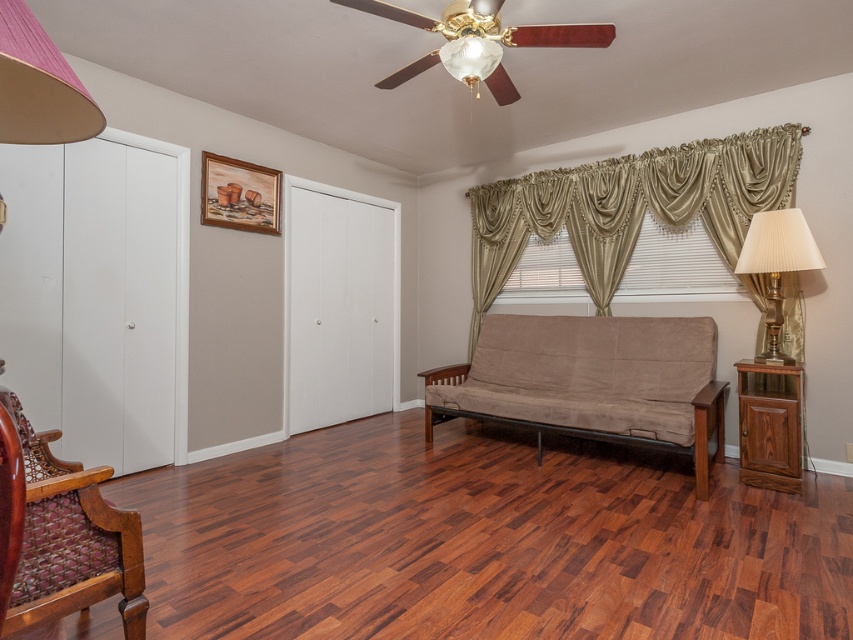
Is suede-like brown futon at center taller than wooden woven armchair at lower left?

Indeed, suede-like brown futon at center has a greater height compared to wooden woven armchair at lower left.

Which of these two, suede-like brown futon at center or wooden woven armchair at lower left, stands taller?

suede-like brown futon at center

Measure the distance between suede-like brown futon at center and camera.

They are 2.97 meters apart.

You are a GUI agent. You are given a task and a screenshot of the screen. Output one action in this format:
    pyautogui.click(x=<x>, y=<y>)
    Task: Click on the suede-like brown futon at center
    Image resolution: width=853 pixels, height=640 pixels.
    Given the screenshot: What is the action you would take?
    pyautogui.click(x=590, y=381)

Does point (772, 186) lie in front of point (770, 257)?

No, (772, 186) is further to viewer.

You are a GUI agent. You are given a task and a screenshot of the screen. Output one action in this format:
    pyautogui.click(x=<x>, y=<y>)
    Task: Click on the satin/golden drapes at upper right
    This screenshot has width=853, height=640.
    Given the screenshot: What is the action you would take?
    pyautogui.click(x=630, y=205)

Who is more distant from viewer, (x=595, y=189) or (x=792, y=241)?

The point (x=595, y=189) is behind.

Locate an element on the screen. The width and height of the screenshot is (853, 640). satin/golden drapes at upper right is located at coordinates (630, 205).

Does satin/golden drapes at upper right appear on the left side of walnut wood cabinet at right?

Indeed, satin/golden drapes at upper right is positioned on the left side of walnut wood cabinet at right.

Does point (705, 147) come behind point (793, 371)?

That is True.

Does point (729, 164) come behind point (740, 422)?

Yes, point (729, 164) is farther from viewer.

Locate an element on the screen. satin/golden drapes at upper right is located at coordinates (630, 205).